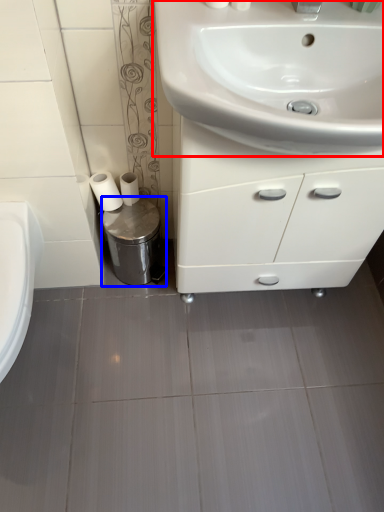
Question: Which object appears farthest to the camera in this image, sink (highlighted by a red box) or bidet (highlighted by a blue box)?

Choices:
 (A) sink
 (B) bidet

Answer: (B)